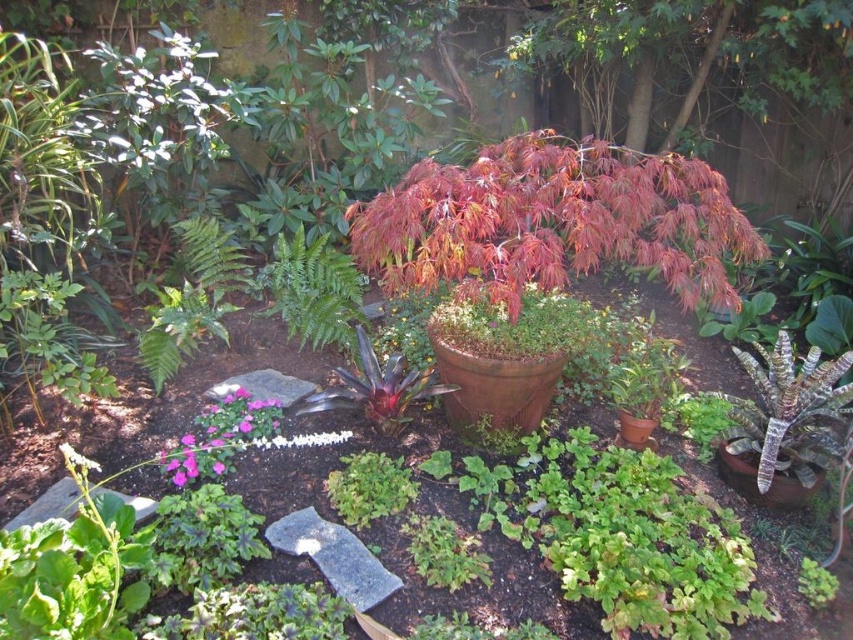
Is terracotta pot at center wider than green textured plant at lower right?

Yes.

Can you confirm if terracotta pot at center is bigger than green textured plant at lower right?

Indeed, terracotta pot at center has a larger size compared to green textured plant at lower right.

Who is more forward, (585, 340) or (776, 480)?

Point (776, 480) is more forward.

I want to click on terracotta pot at center, so click(505, 360).

Does shiny red maple at center have a smaller size compared to green textured plant at lower right?

No.

Does point (392, 193) lie in front of point (746, 467)?

No, (392, 193) is further to viewer.

Where is `shiny red maple at center`? shiny red maple at center is located at coordinates (553, 221).

Does pink matte flower at center appear over matte brown pot at center?

Actually, pink matte flower at center is below matte brown pot at center.

In the scene shown: Does pink matte flower at center have a lesser width compared to matte brown pot at center?

No.

What do you see at coordinates (219, 436) in the screenshot?
I see `pink matte flower at center` at bounding box center [219, 436].

Where is `pink matte flower at center`? This screenshot has height=640, width=853. pink matte flower at center is located at coordinates (219, 436).